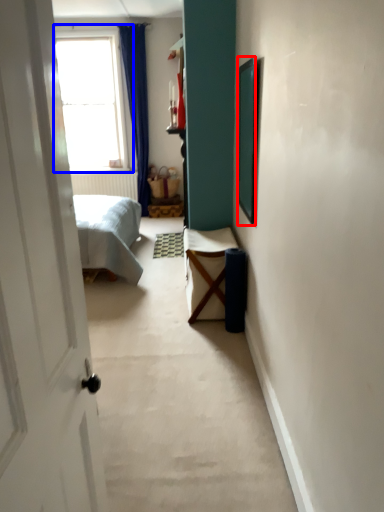
Question: Which of the following is the closest to the observer, picture frame (highlighted by a red box) or window (highlighted by a blue box)?

Choices:
 (A) picture frame
 (B) window

Answer: (A)